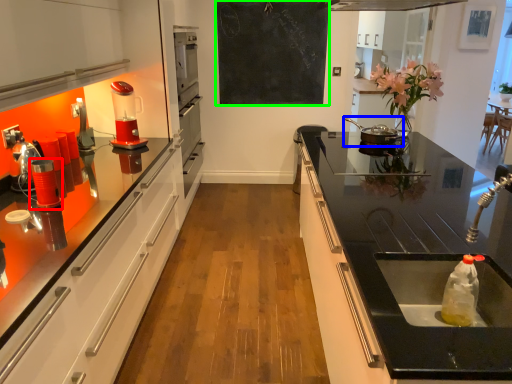
Question: Based on their relative distances, which object is nearer to appliance (highlighted by a red box)? Choose from appliance (highlighted by a blue box) and bulletin board (highlighted by a green box).

Choices:
 (A) appliance
 (B) bulletin board

Answer: (A)